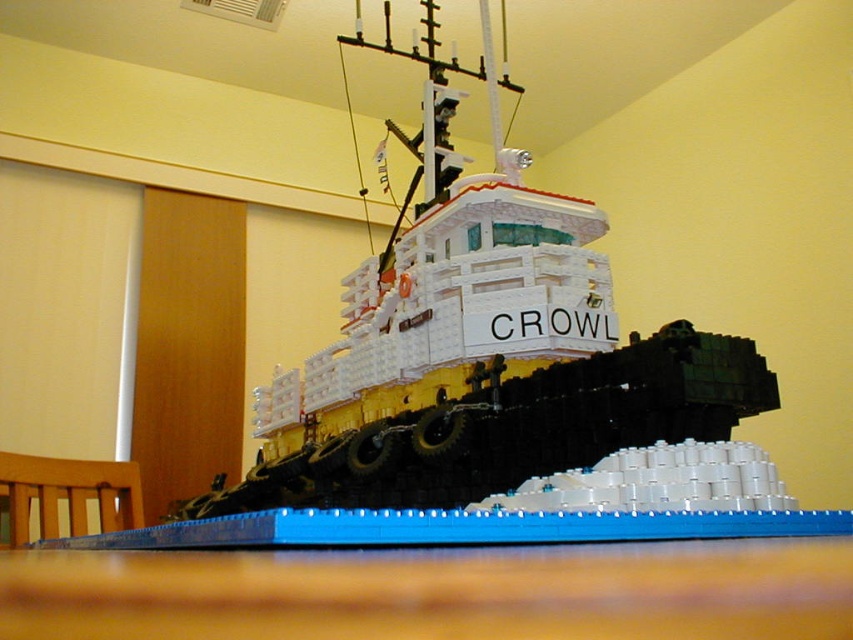
Who is taller, white plastic boat at center or blue plastic table at lower center?

white plastic boat at center

Who is more distant from viewer, (769, 392) or (252, 596)?

Point (769, 392)

Identify the location of white plastic boat at center. (479, 346).